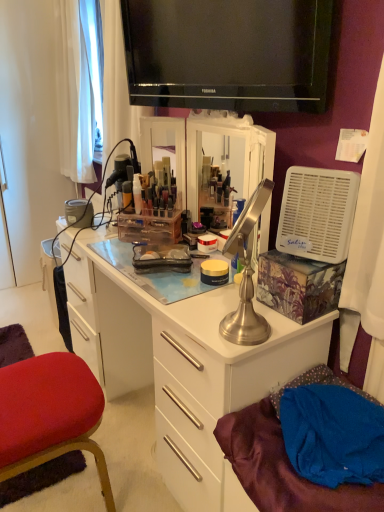
What do you see at coordinates (317, 213) in the screenshot? I see `white plastic fan at right` at bounding box center [317, 213].

This screenshot has width=384, height=512. What do you see at coordinates (182, 361) in the screenshot?
I see `satin silver desk at center` at bounding box center [182, 361].

The height and width of the screenshot is (512, 384). What are the coordinates of `blue fabric at lower right` in the screenshot? It's located at (286, 458).

There is a satin silver desk at center. What are the coordinates of `appliance above it (from a real-world perspective)` in the screenshot? It's located at (317, 213).

Is white plastic fan at right bigger than satin silver desk at center?

Actually, white plastic fan at right might be smaller than satin silver desk at center.

From their relative heights in the image, would you say white plastic fan at right is taller or shorter than satin silver desk at center?

In the image, white plastic fan at right appears to be shorter than satin silver desk at center.

Between white plastic fan at right and satin silver desk at center, which one is positioned in front?

Positioned in front is satin silver desk at center.

Which of these two, velvet red chair at lower left or satin silver lamp at center, stands taller?

With more height is satin silver lamp at center.

Is velvet red chair at lower left looking in the opposite direction of satin silver lamp at center?

No, velvet red chair at lower left's orientation is not away from satin silver lamp at center.

From the image's perspective, relative to satin silver lamp at center, is velvet red chair at lower left above or below?

Based on their image positions, velvet red chair at lower left is located beneath satin silver lamp at center.

Locate an element on the screen. The image size is (384, 512). chair below the satin silver lamp at center (from the image's perspective) is located at coordinates (50, 414).

Based on the photo, which object is further away from the camera taking this photo, velvet red chair at lower left or black glossy television at upper center?

velvet red chair at lower left is further away from the camera.

Which of these two, velvet red chair at lower left or black glossy television at upper center, is thinner?

Thinner between the two is black glossy television at upper center.

The height and width of the screenshot is (512, 384). I want to click on chair lying behind the black glossy television at upper center, so click(50, 414).

Relative to velvet red chair at lower left, is satin silver desk at center in front or behind?

Visually, satin silver desk at center is located in front of velvet red chair at lower left.

Does satin silver desk at center appear on the left side of velvet red chair at lower left?

No, satin silver desk at center is not to the left of velvet red chair at lower left.

From a real-world perspective, is satin silver desk at center positioned above or below velvet red chair at lower left?

satin silver desk at center is situated higher than velvet red chair at lower left in the real world.

Does satin silver desk at center have a lesser width compared to velvet red chair at lower left?

Indeed, satin silver desk at center has a lesser width compared to velvet red chair at lower left.

From a real-world perspective, is black glossy television at upper center on top of white plastic fan at right?

Yes, from a real-world perspective, black glossy television at upper center is on top of white plastic fan at right.

Could you tell me if black glossy television at upper center is turned towards white plastic fan at right?

No, black glossy television at upper center does not turn towards white plastic fan at right.

Who is smaller, satin silver lamp at center or satin silver desk at center?

satin silver lamp at center is smaller.

From a real-world perspective, between satin silver lamp at center and satin silver desk at center, who is vertically higher?

satin silver lamp at center.

Find the location of a particular element. This screenshot has width=384, height=512. desk lying on the left of satin silver lamp at center is located at coordinates (182, 361).

Is satin silver lamp at center not close to satin silver desk at center?

That's not correct — satin silver lamp at center is a little close to satin silver desk at center.

Is the surface of blue fabric at lower right in direct contact with satin silver desk at center?

blue fabric at lower right and satin silver desk at center are not in contact.

Is blue fabric at lower right behind satin silver desk at center?

That is False.

From a real-world perspective, between blue fabric at lower right and satin silver desk at center, who is vertically lower?

satin silver desk at center is physically lower.

From the image's perspective, relative to satin silver desk at center, is blue fabric at lower right above or below?

blue fabric at lower right is situated lower than satin silver desk at center in the image.

In the image, there is a satin silver desk at center. What are the coordinates of `appliance above it (from the image's perspective)` in the screenshot? It's located at (317, 213).

The width and height of the screenshot is (384, 512). In order to click on chair below the satin silver lamp at center (from a real-world perspective) in this screenshot , I will do `click(50, 414)`.

Estimate the real-world distances between objects in this image. Which object is closer to black glossy television at upper center, satin silver desk at center or velvet red chair at lower left?

satin silver desk at center.

Based on their spatial positions, is velvet red chair at lower left or black glossy television at upper center further from white plastic fan at right?

Among the two, velvet red chair at lower left is located further to white plastic fan at right.

Which object lies nearer to the anchor point satin silver lamp at center, satin silver desk at center or velvet red chair at lower left?

satin silver desk at center.

Estimate the real-world distances between objects in this image. Which object is closer to blue fabric at lower right, black glossy television at upper center or satin silver lamp at center?

The object closer to blue fabric at lower right is satin silver lamp at center.

Estimate the real-world distances between objects in this image. Which object is closer to blue fabric at lower right, white plastic fan at right or satin silver lamp at center?

Based on the image, satin silver lamp at center appears to be nearer to blue fabric at lower right.

Considering their positions, is blue fabric at lower right positioned further to satin silver lamp at center than white plastic fan at right?

blue fabric at lower right.

From the picture: Looking at the image, which one is located closer to blue fabric at lower right, velvet red chair at lower left or satin silver desk at center?

satin silver desk at center.

Which object lies nearer to the anchor point blue fabric at lower right, velvet red chair at lower left or black glossy television at upper center?

Among the two, velvet red chair at lower left is located nearer to blue fabric at lower right.

I want to click on appliance situated between velvet red chair at lower left and blue fabric at lower right from left to right, so click(317, 213).

I want to click on desk between black glossy television at upper center and velvet red chair at lower left vertically, so click(182, 361).

Identify the location of lamp between velvet red chair at lower left and blue fabric at lower right from left to right. The image size is (384, 512). (246, 275).

You are a GUI agent. You are given a task and a screenshot of the screen. Output one action in this format:
    pyautogui.click(x=<x>, y=<y>)
    Task: Click on the lamp between white plastic fan at right and satin silver desk at center in the up-down direction
    
    Given the screenshot: What is the action you would take?
    pyautogui.click(x=246, y=275)